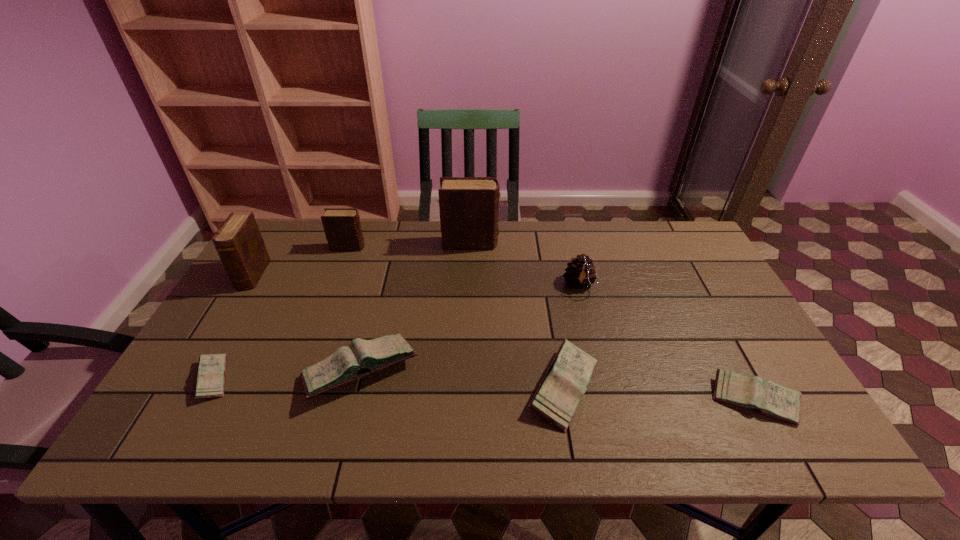
Locate an element on the screen. This screenshot has width=960, height=540. free location at the far right corner is located at coordinates (691, 261).

This screenshot has width=960, height=540. I want to click on free space between the fifth shortest diary and the biggest brown diary, so click(x=410, y=245).

Where is `free space between the tallest diary and the smallest pink diary`? The height and width of the screenshot is (540, 960). free space between the tallest diary and the smallest pink diary is located at coordinates (342, 311).

The image size is (960, 540). Find the location of `free space between the pinecone and the leftmost brown diary`. free space between the pinecone and the leftmost brown diary is located at coordinates (416, 280).

What are the coordinates of `free spot between the third tallest object and the third farthest diary` in the screenshot? It's located at (300, 261).

Locate an element on the screen. vacant area that lies between the second brown diary from left to right and the smallest pink diary is located at coordinates (281, 313).

The height and width of the screenshot is (540, 960). In order to click on vacant space that's between the biggest brown diary and the rightmost object in this screenshot , I will do coord(612,321).

You are a GUI agent. You are given a task and a screenshot of the screen. Output one action in this format:
    pyautogui.click(x=<x>, y=<y>)
    Task: Click on the unoccupied position between the third smallest pink diary and the pinecone
    
    Given the screenshot: What is the action you would take?
    pyautogui.click(x=571, y=336)

Locate an element on the screen. The image size is (960, 540). free spot between the nearest brown diary and the fourth shortest diary is located at coordinates (307, 323).

This screenshot has width=960, height=540. In order to click on vacant space that is in between the leftmost pink diary and the tallest object in this screenshot , I will do `click(342, 311)`.